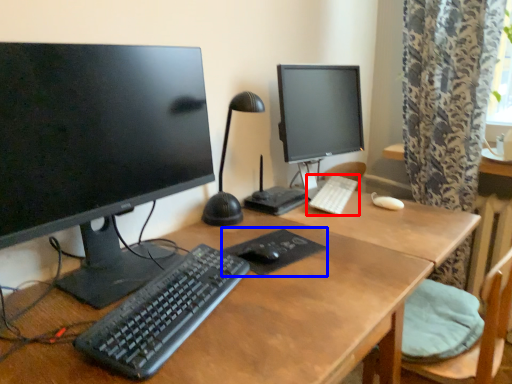
Question: Among these objects, which one is farthest to the camera, computer keyboard (highlighted by a red box) or mousepad (highlighted by a blue box)?

Choices:
 (A) computer keyboard
 (B) mousepad

Answer: (A)